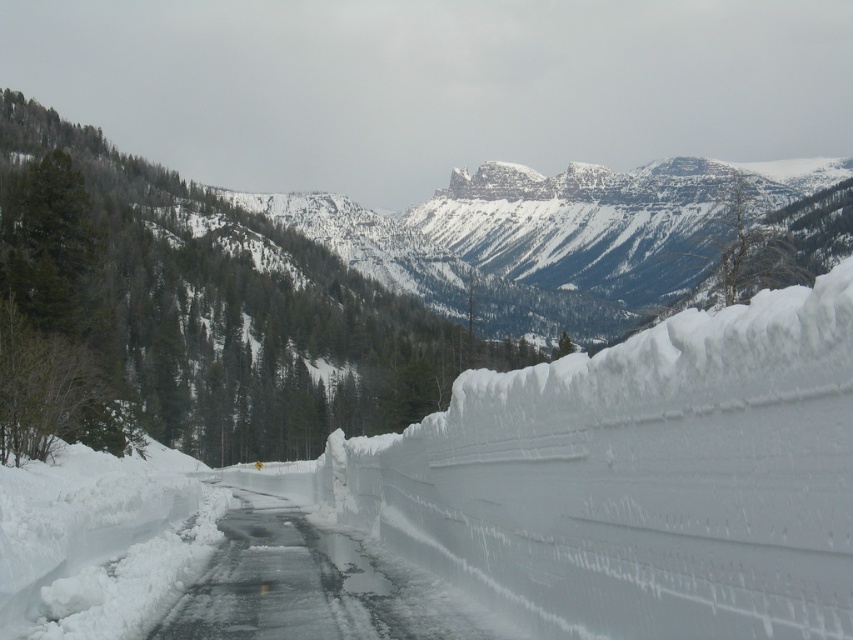
Question: Which object is farther from the camera taking this photo?

Choices:
 (A) icy asphalt road at center
 (B) snowy mountain at center

Answer: (B)

Question: Which of the following is the farthest from the observer?

Choices:
 (A) snowy mountain at center
 (B) icy asphalt road at center

Answer: (A)

Question: Can you confirm if snowy mountain at center is wider than icy asphalt road at center?

Choices:
 (A) no
 (B) yes

Answer: (B)

Question: In this image, where is snowy mountain at center located relative to icy asphalt road at center?

Choices:
 (A) right
 (B) left

Answer: (A)

Question: Which point is farther from the camera taking this photo?

Choices:
 (A) (270, 620)
 (B) (45, 403)

Answer: (B)

Question: Is snowy mountain at center further to the viewer compared to icy asphalt road at center?

Choices:
 (A) yes
 (B) no

Answer: (A)